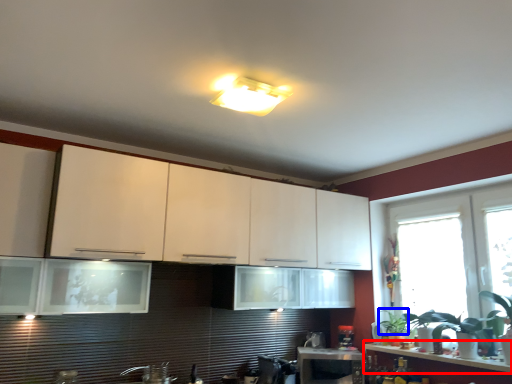
Question: Which object appears closest to the camera in this image, countertop (highlighted by a red box) or plant (highlighted by a blue box)?

Choices:
 (A) countertop
 (B) plant

Answer: (A)